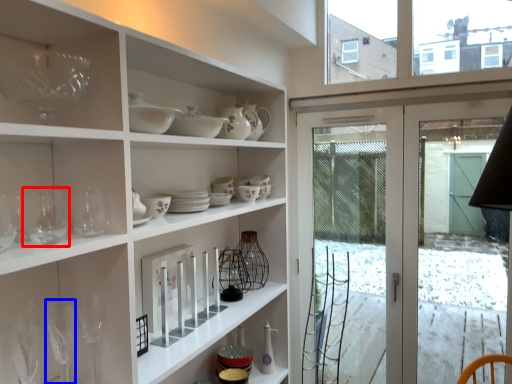
Question: Which point is further to the camera, wine glass (highlighted by a red box) or wine glass (highlighted by a blue box)?

Choices:
 (A) wine glass
 (B) wine glass

Answer: (B)